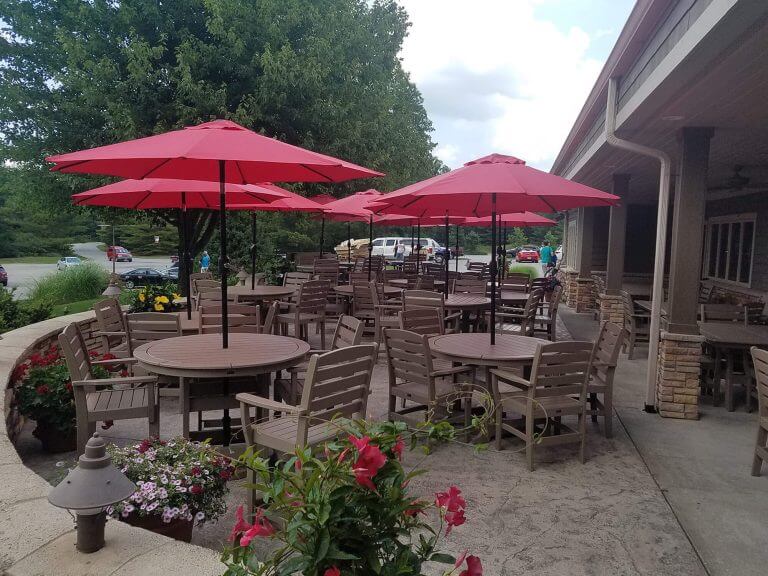
Where is `concrete floor`? This screenshot has width=768, height=576. concrete floor is located at coordinates (657, 503).